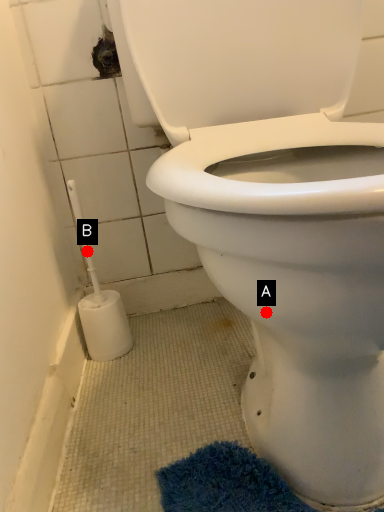
Question: Two points are circled on the image, labeled by A and B beside each circle. Which point is further to the camera?

Choices:
 (A) A is further
 (B) B is further

Answer: (B)